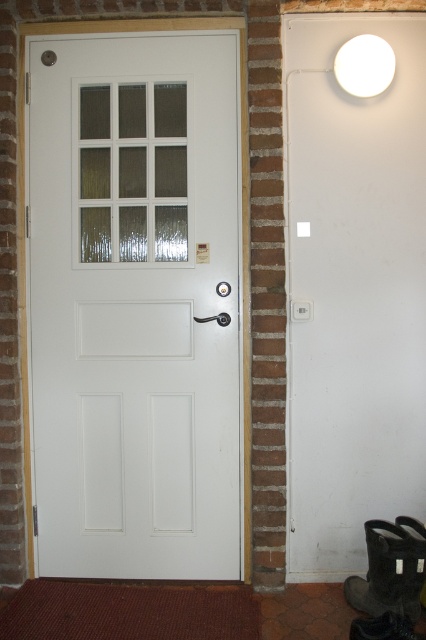
Question: Does white matte door at center appear on the right side of white matte light fixture at upper right?

Choices:
 (A) no
 (B) yes

Answer: (A)

Question: Is white matte door at center behind white matte light fixture at upper right?

Choices:
 (A) yes
 (B) no

Answer: (A)

Question: Which object appears closest to the camera in this image?

Choices:
 (A) white matte door at center
 (B) white matte light fixture at upper right

Answer: (B)

Question: Where is white matte door at center located in relation to white matte light fixture at upper right in the image?

Choices:
 (A) above
 (B) below

Answer: (B)

Question: Which of the following is the farthest from the observer?

Choices:
 (A) white matte door at center
 (B) white matte light fixture at upper right

Answer: (A)

Question: Which of the following is the farthest from the observer?

Choices:
 (A) (351, 65)
 (B) (77, 96)

Answer: (B)